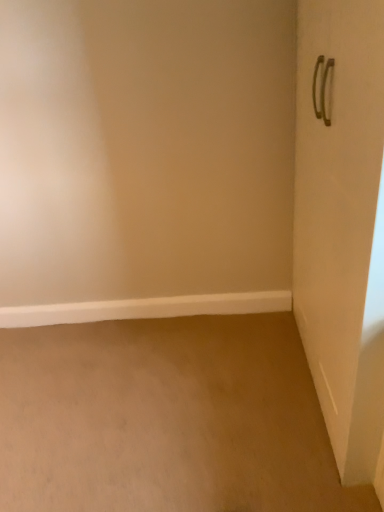
You are a GUI agent. You are given a task and a screenshot of the screen. Output one action in this format:
    pyautogui.click(x=<x>, y=<y>)
    Task: Click on the free space that is to the left of metallic silver handle at right
    
    Given the screenshot: What is the action you would take?
    pyautogui.click(x=231, y=415)